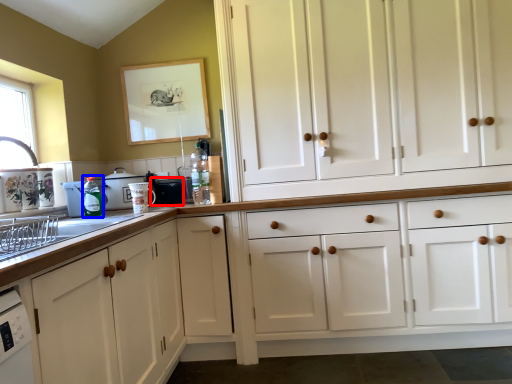
Question: Which of the following is the closest to the observer, appliance (highlighted by a red box) or bottle (highlighted by a blue box)?

Choices:
 (A) appliance
 (B) bottle

Answer: (B)